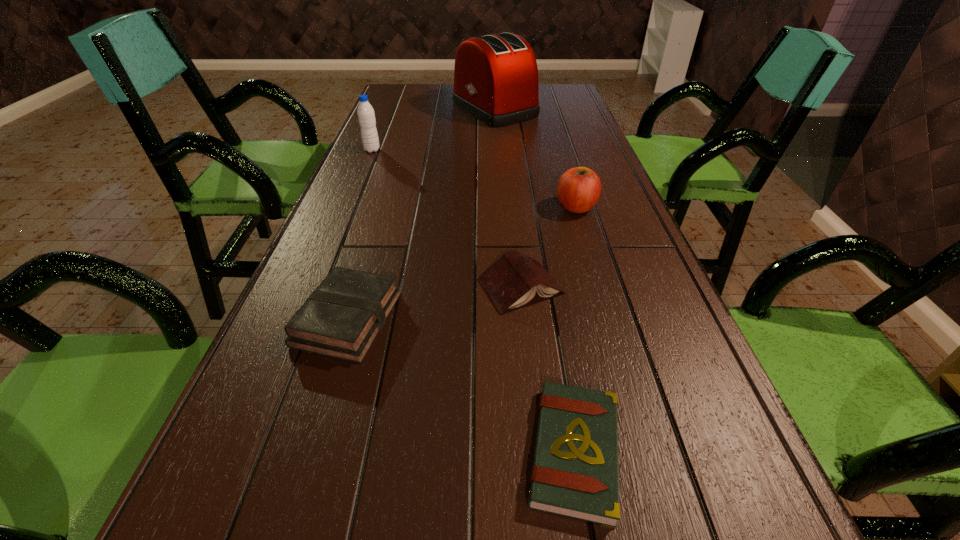
The width and height of the screenshot is (960, 540). I want to click on free space between the shortest object and the leftmost book, so click(461, 386).

I want to click on vacant area that lies between the second tallest object and the apple, so click(474, 179).

The width and height of the screenshot is (960, 540). Find the location of `vacant space that's between the apple and the shortest object`. vacant space that's between the apple and the shortest object is located at coordinates (575, 329).

Locate an element on the screen. The height and width of the screenshot is (540, 960). vacant area that lies between the third farthest object and the water bottle is located at coordinates (474, 179).

This screenshot has height=540, width=960. Identify the location of unoccupied area between the shortest object and the water bottle. (473, 301).

The height and width of the screenshot is (540, 960). I want to click on blank region between the second tallest object and the farthest object, so click(x=433, y=130).

Find the location of a particular element. This screenshot has width=960, height=540. vacant point located between the leftmost book and the apple is located at coordinates (462, 263).

The height and width of the screenshot is (540, 960). In order to click on object that is the second closest to the shortest object in this screenshot , I will do `click(341, 319)`.

Image resolution: width=960 pixels, height=540 pixels. I want to click on object that can be found as the fourth closest to the leftmost book, so click(366, 116).

This screenshot has width=960, height=540. In order to click on book that is the third closest one to the farthest object in this screenshot , I will do `click(575, 473)`.